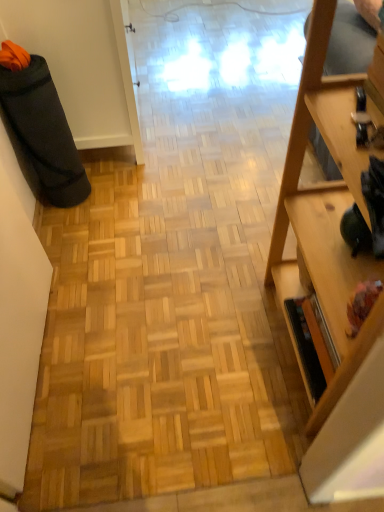
Image resolution: width=384 pixels, height=512 pixels. Find the location of `unoccupied area behind black fabric bag at left`. unoccupied area behind black fabric bag at left is located at coordinates (96, 162).